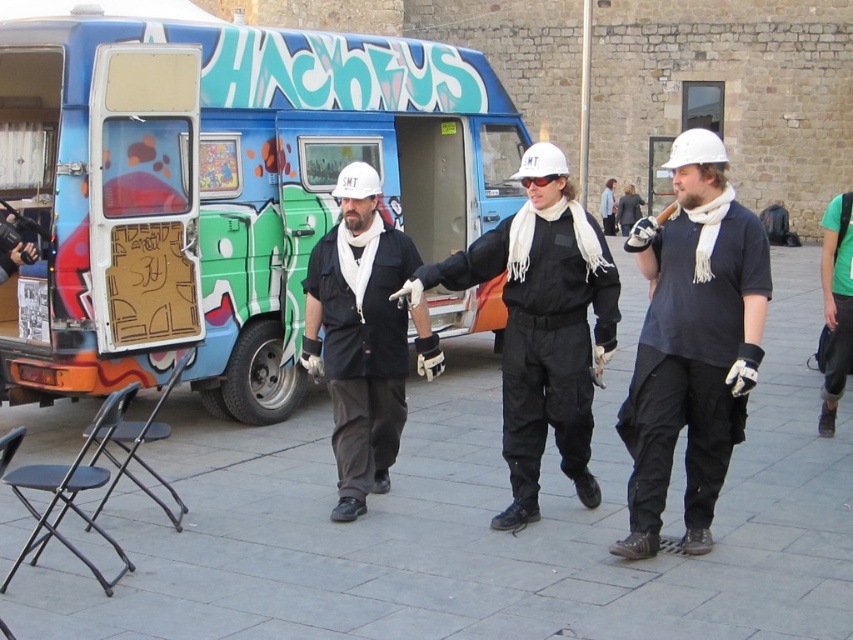
Is point (740, 432) positioned before point (572, 451)?

That is True.

Who is higher up, white matte helmet at center or black matte jacket at center?

black matte jacket at center is higher up.

Identify the location of white matte helmet at center. Image resolution: width=853 pixels, height=640 pixels. (692, 342).

Find the location of a particular element. This screenshot has height=640, width=853. white matte helmet at center is located at coordinates (692, 342).

Measure the distance between point (744, 365) and camera.

They are 5.08 meters apart.

Image resolution: width=853 pixels, height=640 pixels. In order to click on white matte helmet at center in this screenshot , I will do `click(692, 342)`.

Is blue painted van at left smaller than white matte helmet at center?

Actually, blue painted van at left might be larger than white matte helmet at center.

Is blue painted van at left taller than white matte helmet at center?

Yes.

Which is behind, point (265, 60) or point (631, 477)?

The point (265, 60) is behind.

Where is `blue painted van at left`? This screenshot has height=640, width=853. blue painted van at left is located at coordinates pos(236,188).